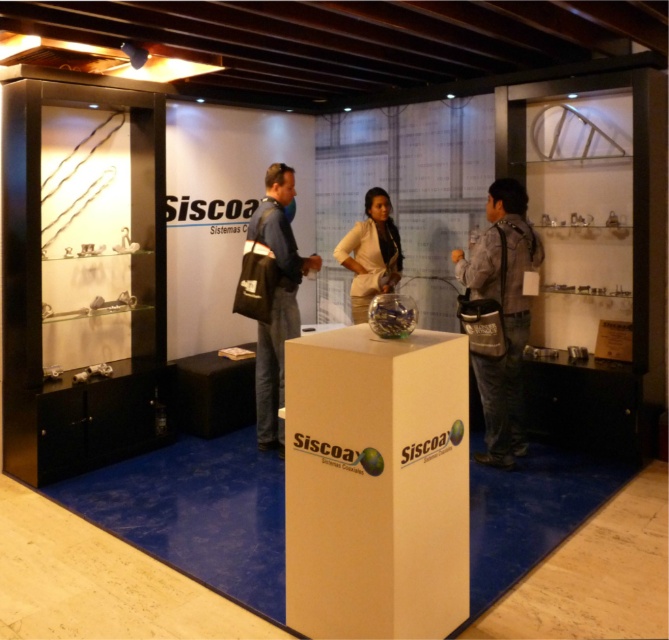
Consider the image. Can you confirm if gray fabric bag at right is wider than dark blue fabric jacket at center?

No.

Does gray fabric bag at right appear on the left side of dark blue fabric jacket at center?

In fact, gray fabric bag at right is to the right of dark blue fabric jacket at center.

Who is more distant from viewer, (522, 403) or (288, 253)?

Positioned behind is point (522, 403).

Identify the location of gray fabric bag at right. The image size is (669, 640). (502, 316).

Measure the distance between point (274, 360) and camera.

The distance of point (274, 360) from camera is 4.08 meters.

Is point (302, 268) positioned before point (343, 257)?

Yes, point (302, 268) is in front of point (343, 257).

Where is `dark blue fabric jacket at center`? This screenshot has width=669, height=640. dark blue fabric jacket at center is located at coordinates (272, 298).

I want to click on dark blue fabric jacket at center, so click(272, 298).

Where is `gray fabric bag at right`? gray fabric bag at right is located at coordinates (502, 316).

Which is more to the right, gray fabric bag at right or beige fabric jacket at center?

Positioned to the right is gray fabric bag at right.

Describe the element at coordinates (502, 316) in the screenshot. I see `gray fabric bag at right` at that location.

At what (x,y) coordinates should I click in order to perform the action: click on gray fabric bag at right. Please return your answer as a coordinate pair (x, y). Image resolution: width=669 pixels, height=640 pixels. Looking at the image, I should click on (502, 316).